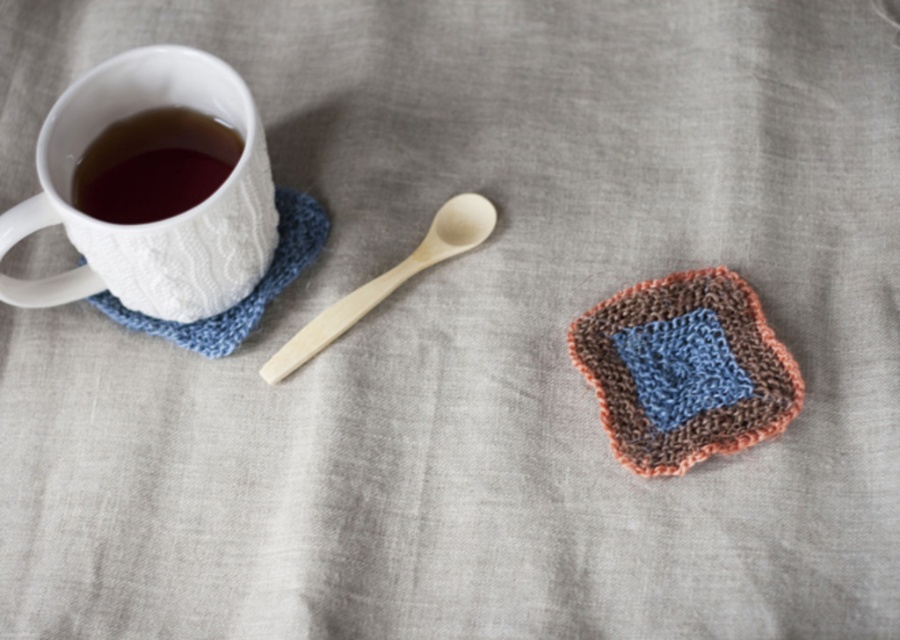
Can you confirm if white textured mug at upper left is shorter than brown matte cup at upper left?

Incorrect, white textured mug at upper left's height does not fall short of brown matte cup at upper left's.

Is point (81, 276) less distant than point (114, 200)?

No.

Between point (220, 243) and point (123, 204), which one is positioned behind?

The point (123, 204) is more distant.

This screenshot has width=900, height=640. Identify the location of white textured mug at upper left. (154, 221).

Can you confirm if brown matte cup at upper left is shorter than wooden spoon at center?

Yes.

Who is positioned more to the left, brown matte cup at upper left or wooden spoon at center?

brown matte cup at upper left

Is point (225, 157) farther from viewer compared to point (477, 243)?

That is False.

Locate an element on the screen. brown matte cup at upper left is located at coordinates pyautogui.click(x=153, y=164).

Can you confirm if white textured mug at upper left is smaller than wooden spoon at center?

No, white textured mug at upper left is not smaller than wooden spoon at center.

Which is below, white textured mug at upper left or wooden spoon at center?

wooden spoon at center is below.

The width and height of the screenshot is (900, 640). Find the location of `white textured mug at upper left`. white textured mug at upper left is located at coordinates (154, 221).

This screenshot has width=900, height=640. In order to click on white textured mug at upper left in this screenshot , I will do `click(154, 221)`.